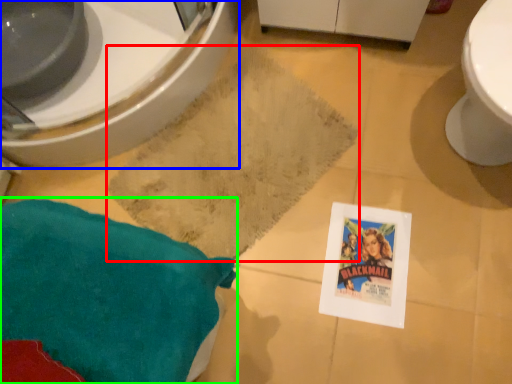
Question: Which object is the closest to the bath mat (highlighted by a red box)? Choose among these: bidet (highlighted by a blue box) or throw pillow (highlighted by a green box).

Choices:
 (A) bidet
 (B) throw pillow

Answer: (A)